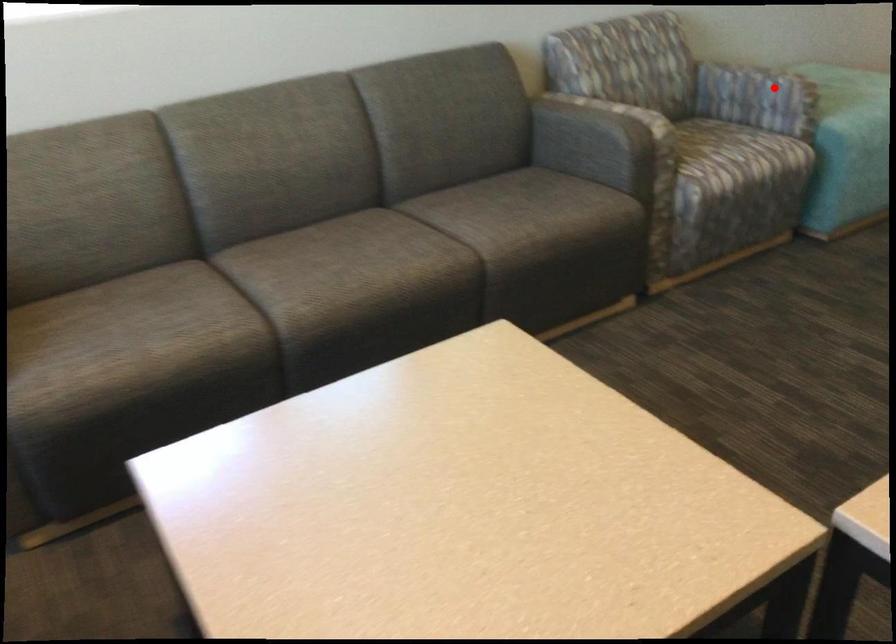
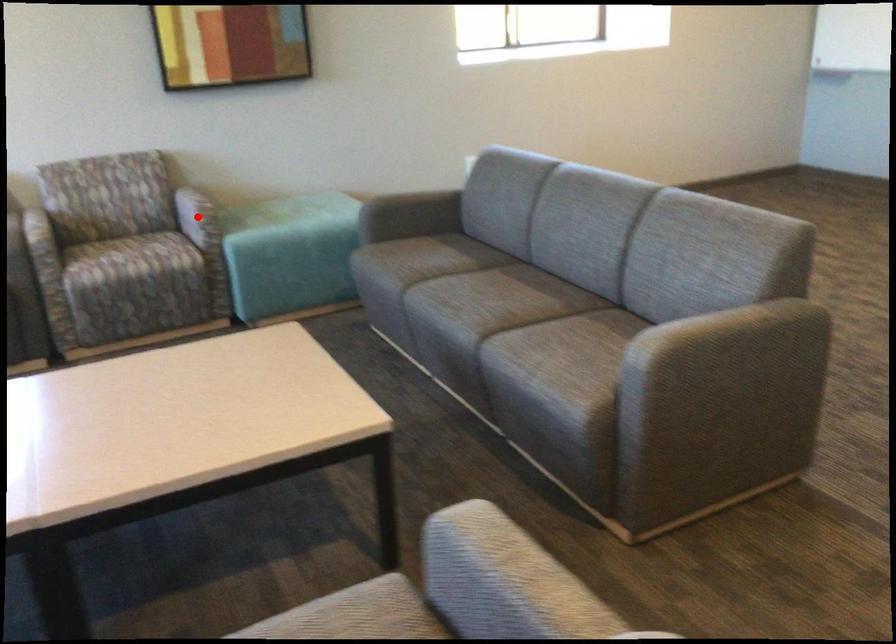
I am providing you with two images of the same scene from different viewpoints. A red point is marked on the first image and another point is marked on the second image. Is the red point in image1 aligned with the point shown in image2?

Yes